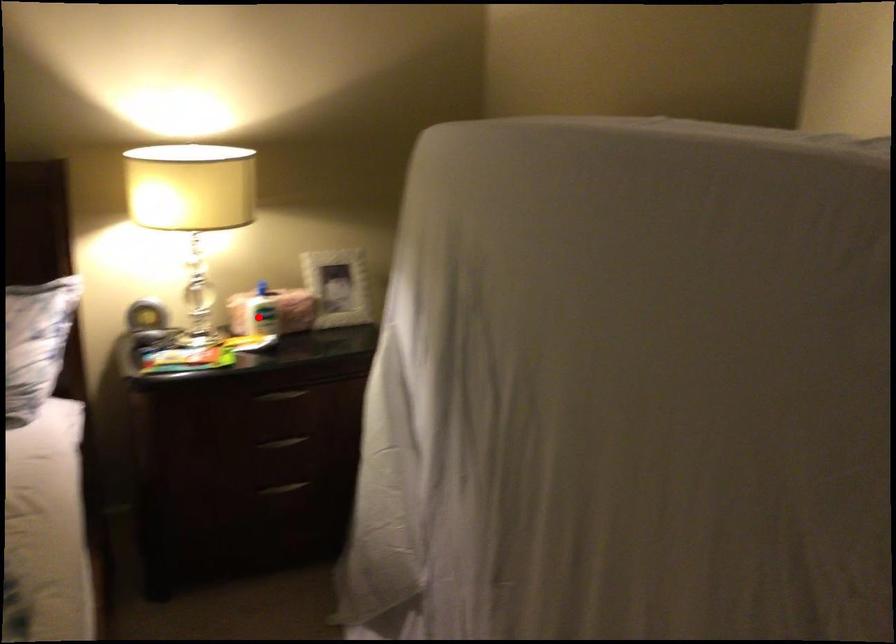
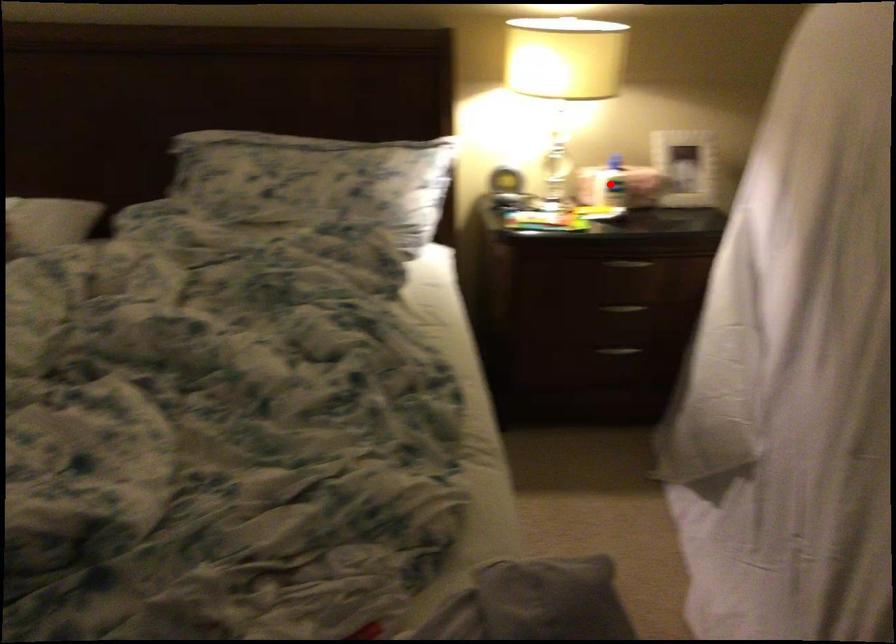
I am providing you with two images of the same scene from different viewpoints. A red point is marked on the first image and another point is marked on the second image. Are the points marked in image1 and image2 representing the same 3D position?

Yes